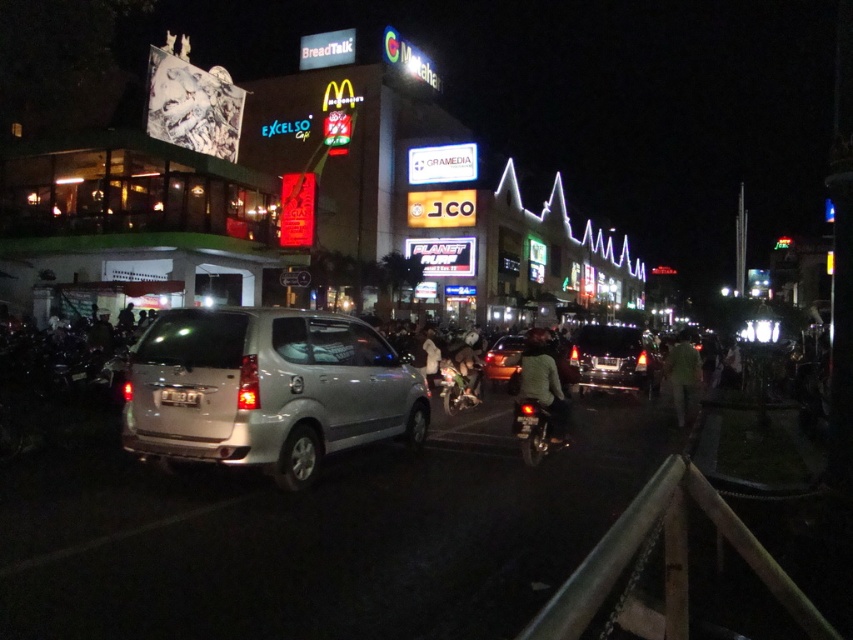
Question: Does dark green fabric jacket at center appear over green fabric jacket at center?

Choices:
 (A) no
 (B) yes

Answer: (B)

Question: Among these objects, which one is farthest from the camera?

Choices:
 (A) dark green fabric jacket at center
 (B) satin black suv at center

Answer: (B)

Question: Estimate the real-world distances between objects in this image. Which object is farther from the green fabric jacket at center?

Choices:
 (A) matte glass building at center
 (B) white fabric person at center
 (C) silver metallic car at center
 (D) black matte motorcycle at center

Answer: (A)

Question: Can you confirm if matte glass building at center is positioned below satin black suv at center?

Choices:
 (A) no
 (B) yes

Answer: (A)

Question: Which object appears farthest from the camera in this image?

Choices:
 (A) white fabric person at center
 (B) metallic silver motorcycle at center
 (C) green fabric jacket at center
 (D) dark green fabric jacket at center

Answer: (C)

Question: Is green fabric person at right to the right of white fabric person at center from the viewer's perspective?

Choices:
 (A) yes
 (B) no

Answer: (A)